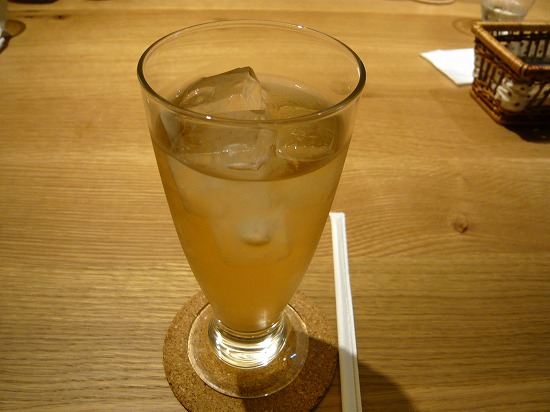
The image size is (550, 412). I want to click on rim of glass, so click(x=349, y=97), click(x=194, y=119), click(x=140, y=58), click(x=233, y=21), click(x=331, y=40).